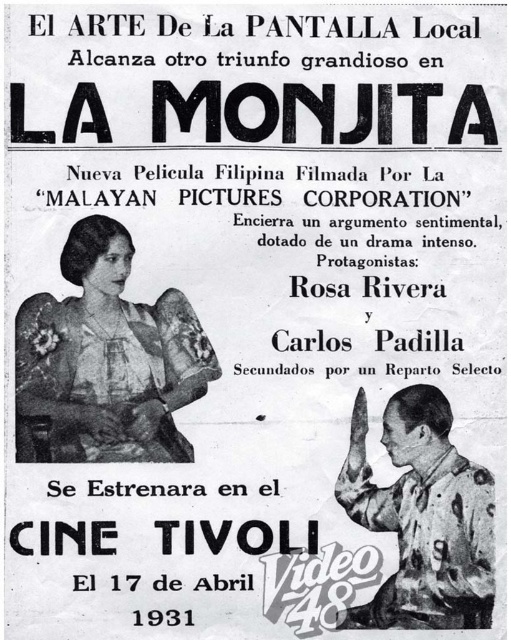
Which is below, matte floral dress at center-left or camouflage fabric uniform at lower right?

camouflage fabric uniform at lower right

Between matte floral dress at center-left and camouflage fabric uniform at lower right, which one has more height?

matte floral dress at center-left

Is point (190, 330) closer to viewer compared to point (432, 563)?

No, it is behind (432, 563).

You are a GUI agent. You are given a task and a screenshot of the screen. Output one action in this format:
    pyautogui.click(x=<x>, y=<y>)
    Task: Click on the matte floral dress at center-left
    This screenshot has width=511, height=640.
    Given the screenshot: What is the action you would take?
    pyautogui.click(x=105, y=360)